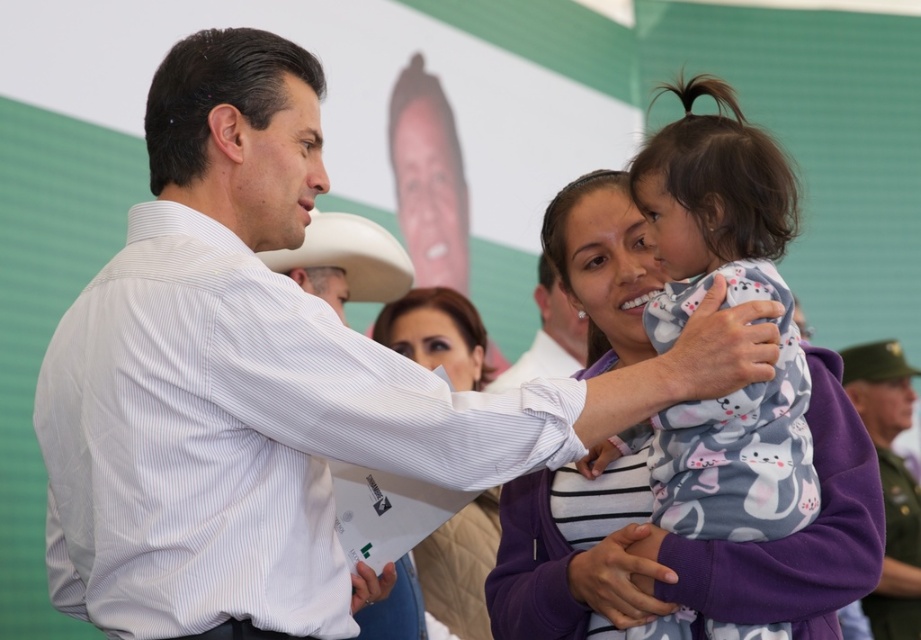
Question: Is smooth beige sweater at center to the right of white matte cowboy hat at upper center from the viewer's perspective?

Choices:
 (A) no
 (B) yes

Answer: (B)

Question: Can you confirm if printed cotton onesie at center is wider than purple fleece jacket at center?

Choices:
 (A) no
 (B) yes

Answer: (A)

Question: Does printed cotton onesie at center appear on the left side of smooth beige sweater at center?

Choices:
 (A) yes
 (B) no

Answer: (B)

Question: Which object appears closest to the camera in this image?

Choices:
 (A) white striped shirt at upper center
 (B) purple fleece jacket at center
 (C) white matte cowboy hat at upper center

Answer: (C)

Question: Which point appears farthest from the camera in this image?

Choices:
 (A) 876,378
 (B) 398,595
 (C) 309,278
 (D) 540,282

Answer: (A)

Question: Considering the real-world distances, which object is closest to the purple fleece jacket at center?

Choices:
 (A) white striped shirt at upper center
 (B) printed cotton onesie at center

Answer: (A)